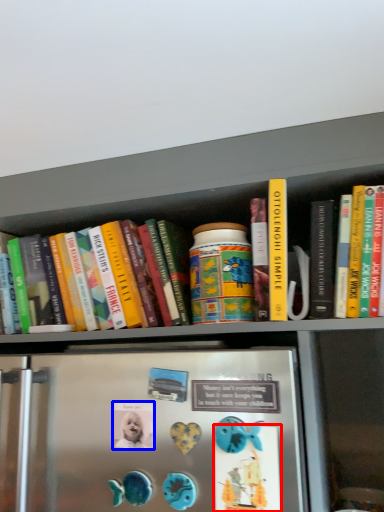
Question: Which of the following is the closest to the observer, button (highlighted by a red box) or button (highlighted by a blue box)?

Choices:
 (A) button
 (B) button

Answer: (A)